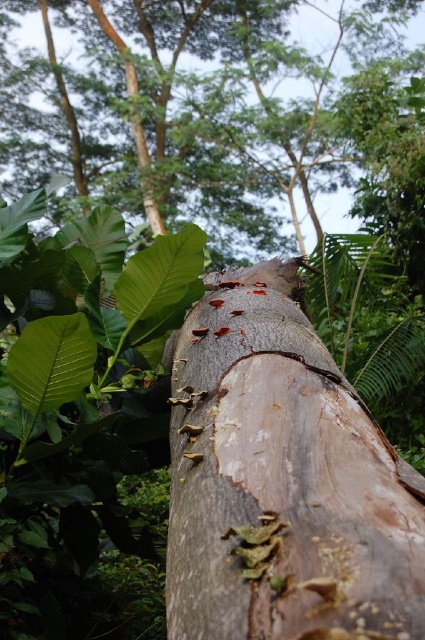
Question: Is smooth brown bark at center to the right of rusty wood tree trunk at center from the viewer's perspective?

Choices:
 (A) yes
 (B) no

Answer: (B)

Question: Is smooth brown bark at center closer to the viewer compared to rusty wood tree trunk at center?

Choices:
 (A) yes
 (B) no

Answer: (B)

Question: Which object appears closest to the camera in this image?

Choices:
 (A) rusty wood tree trunk at center
 (B) smooth brown bark at center

Answer: (A)

Question: In this image, where is smooth brown bark at center located relative to rusty wood tree trunk at center?

Choices:
 (A) left
 (B) right

Answer: (A)